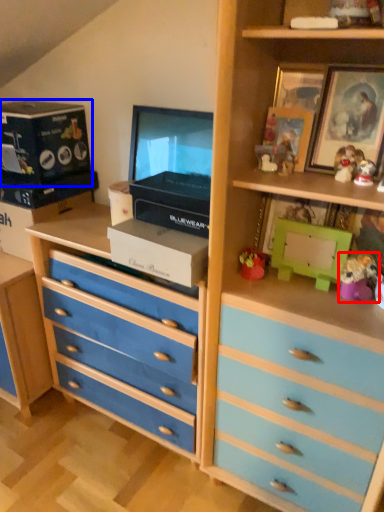
Question: Which point is further to the camera, toy (highlighted by a red box) or box (highlighted by a blue box)?

Choices:
 (A) toy
 (B) box

Answer: (B)